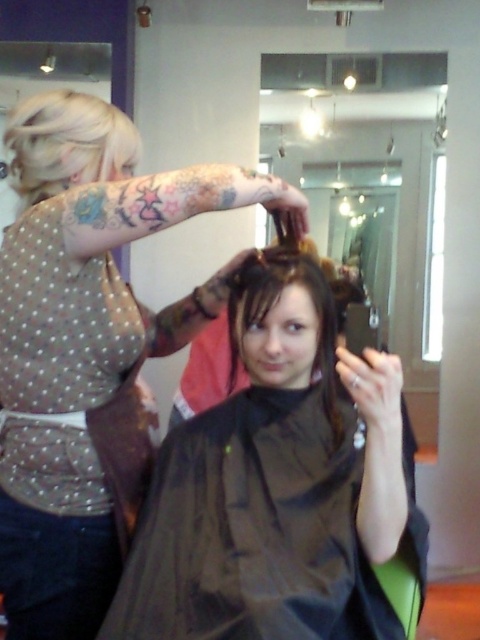
Is matte black hair at center below dark brown hair at center?

Actually, matte black hair at center is above dark brown hair at center.

From the picture: Who is lower down, matte black hair at center or dark brown hair at center?

dark brown hair at center is lower down.

Does point (183, 298) come behind point (251, 314)?

Yes.

Locate an element on the screen. Image resolution: width=480 pixels, height=640 pixels. matte black hair at center is located at coordinates (86, 342).

Between shiny black hair at center and matte black hair at center, which one is positioned lower?

shiny black hair at center is lower down.

Based on the photo, can you confirm if shiny black hair at center is positioned below matte black hair at center?

Correct, shiny black hair at center is located below matte black hair at center.

This screenshot has width=480, height=640. Identify the location of shiny black hair at center. (277, 484).

In the scene shown: Is blonde shiny hair at upper left shorter than dark brown hair at center?

Correct, blonde shiny hair at upper left is not as tall as dark brown hair at center.

Does blonde shiny hair at upper left appear under dark brown hair at center?

No.

Is point (117, 112) positioned after point (317, 288)?

That is True.

At what (x,y) coordinates should I click in order to perform the action: click on blonde shiny hair at upper left. Please return your answer as a coordinate pair (x, y). The width and height of the screenshot is (480, 640). Looking at the image, I should click on (68, 144).